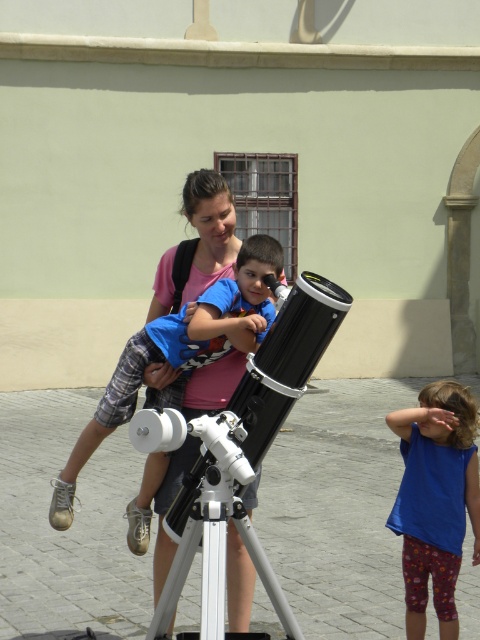
I want to click on blue cotton shirt at center, so click(x=186, y=342).

Who is more distant from viewer, (127, 513) or (418, 560)?

Positioned behind is point (127, 513).

Does point (152, 362) lie in front of point (445, 442)?

Yes, point (152, 362) is in front of point (445, 442).

Locate an element on the screen. The width and height of the screenshot is (480, 640). blue cotton shirt at center is located at coordinates (186, 342).